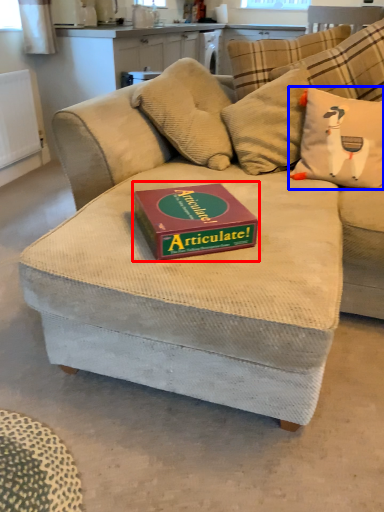
Question: Among these objects, which one is farthest to the camera, paperback book (highlighted by a red box) or throw pillow (highlighted by a blue box)?

Choices:
 (A) paperback book
 (B) throw pillow

Answer: (B)